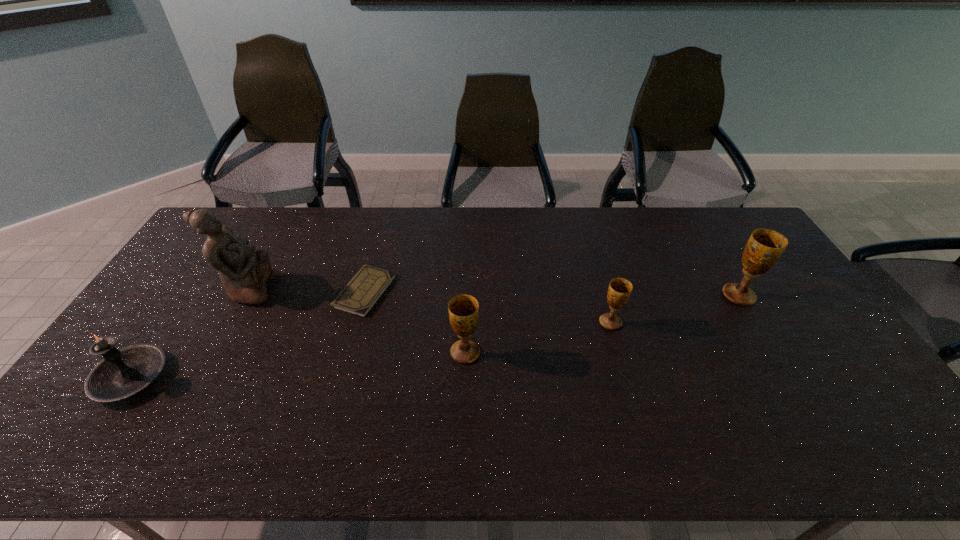
Identify the location of the second shortest chalice. The width and height of the screenshot is (960, 540). (463, 309).

Where is `the nearest chalice`? The image size is (960, 540). the nearest chalice is located at coordinates (463, 309).

Find the location of a particular element. This screenshot has width=960, height=540. the second nearest chalice is located at coordinates (619, 291).

Locate an element on the screen. the second chalice from left to right is located at coordinates (619, 291).

Find the location of a particular element. The height and width of the screenshot is (540, 960). the tallest chalice is located at coordinates (764, 248).

Find the location of `the fifth shortest object`. the fifth shortest object is located at coordinates (764, 248).

The width and height of the screenshot is (960, 540). What are the coordinates of `figurine` in the screenshot? It's located at click(243, 272).

The width and height of the screenshot is (960, 540). I want to click on the tallest object, so click(243, 272).

Where is `the leftmost object`? The height and width of the screenshot is (540, 960). the leftmost object is located at coordinates (122, 373).

I want to click on checkbook, so click(x=359, y=296).